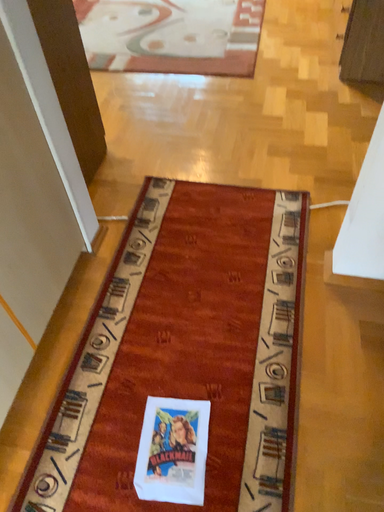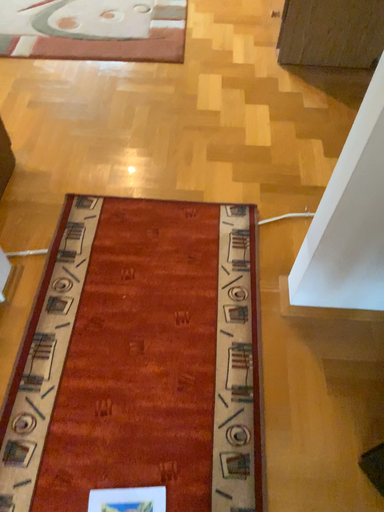
Question: How did the camera likely rotate when shooting the video?

Choices:
 (A) rotated right
 (B) rotated left

Answer: (A)